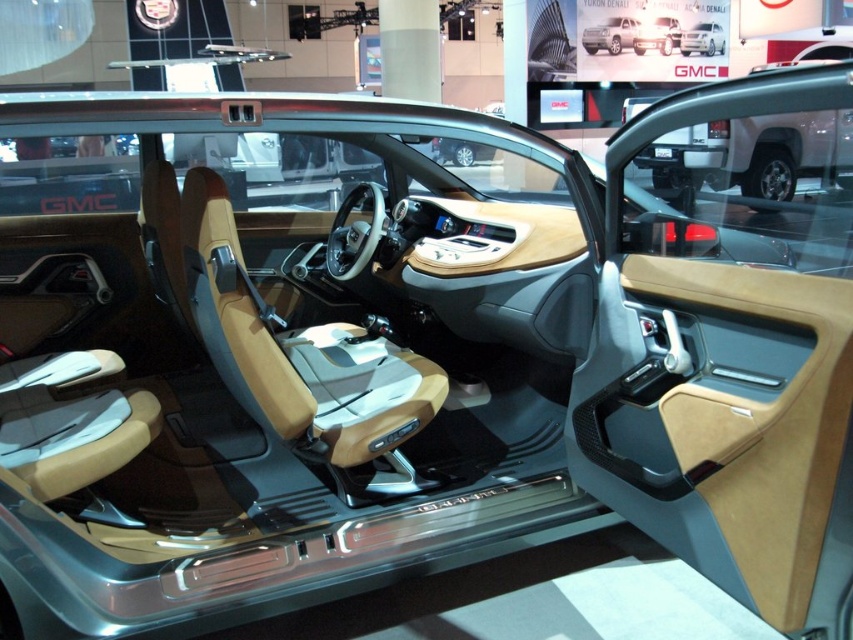
You are a photographer trying to capture both trucks in the image. Since the white matte truck at upper center and the white glossy truck at upper center are both at the same position, which one would you need to focus on first to ensure it is in sharp focus?

The white matte truck at upper center has a smaller size compared to white glossy truck at upper center, so you should focus on the smaller one first to ensure it is in sharp focus.

You are an auto show attendee comparing two white trucks displayed on the dashboard. The trucks are labeled as the white matte truck at upper center and the white glossy truck at upper center. Which truck has a narrower width?

The white matte truck at upper center is thinner than the white glossy truck at upper center, so the white matte truck at upper center has a narrower width.